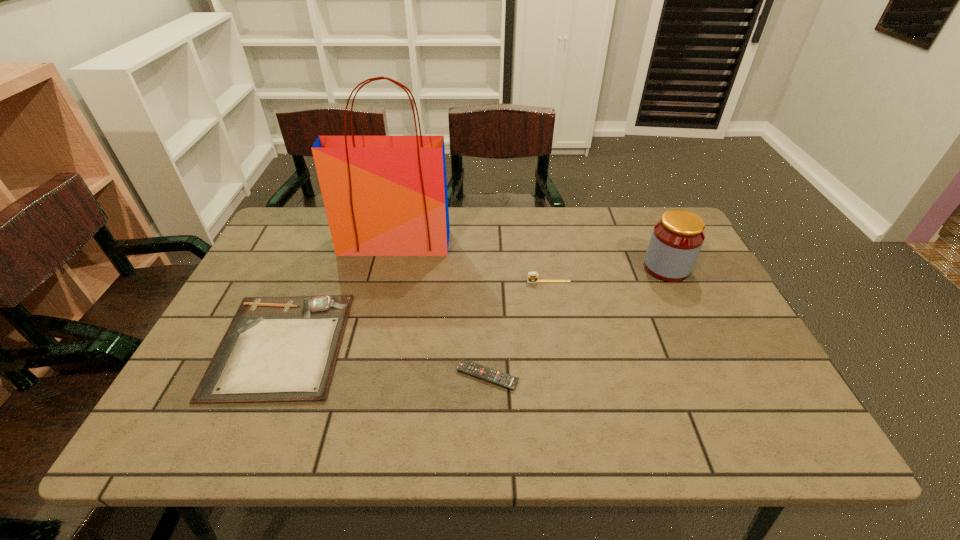
The height and width of the screenshot is (540, 960). What are the coordinates of `vacant space located 0.070m at the front of the tape measure with the tape extended` in the screenshot? It's located at (552, 301).

This screenshot has width=960, height=540. What are the coordinates of `vacant space located on the back of the fourth tallest object` in the screenshot? It's located at (323, 248).

Identify the location of vacant region located on the right of the remote control. The height and width of the screenshot is (540, 960). (616, 376).

Identify the location of object that is at the far edge. The width and height of the screenshot is (960, 540). tap(384, 195).

What are the coordinates of `object positioned at the left edge` in the screenshot? It's located at (276, 349).

Identify the location of object that is at the right edge. Image resolution: width=960 pixels, height=540 pixels. (677, 238).

In the image, there is a desktop. Where is `vacant space at the far edge`? vacant space at the far edge is located at coordinates (587, 228).

Locate an element on the screen. vacant area at the near edge is located at coordinates (717, 441).

Where is `blank space at the right edge of the desktop`? The width and height of the screenshot is (960, 540). blank space at the right edge of the desktop is located at coordinates (702, 307).

I want to click on free space at the near left corner, so click(x=227, y=409).